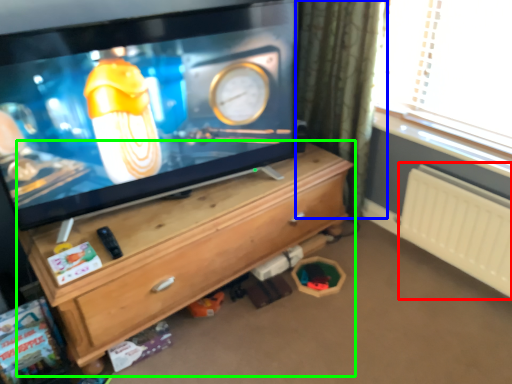
Question: Based on their relative distances, which object is farther from radiator (highlighted by a red box)? Choose from curtain (highlighted by a blue box) and chest of drawers (highlighted by a green box).

Choices:
 (A) curtain
 (B) chest of drawers

Answer: (B)